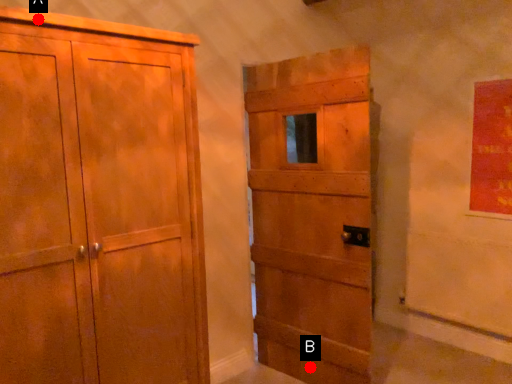
Question: Two points are circled on the image, labeled by A and B beside each circle. Which point is farther to the camera?

Choices:
 (A) A is further
 (B) B is further

Answer: (B)